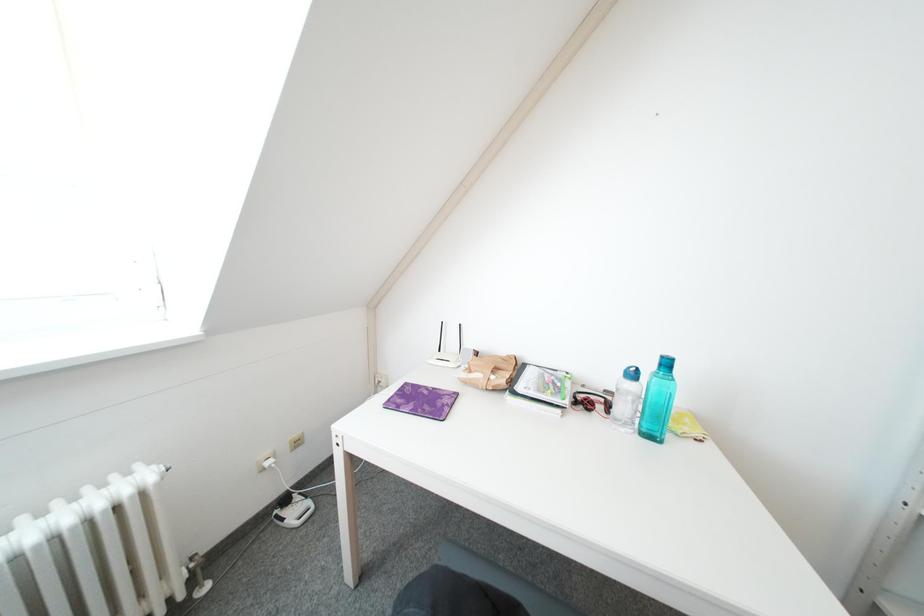
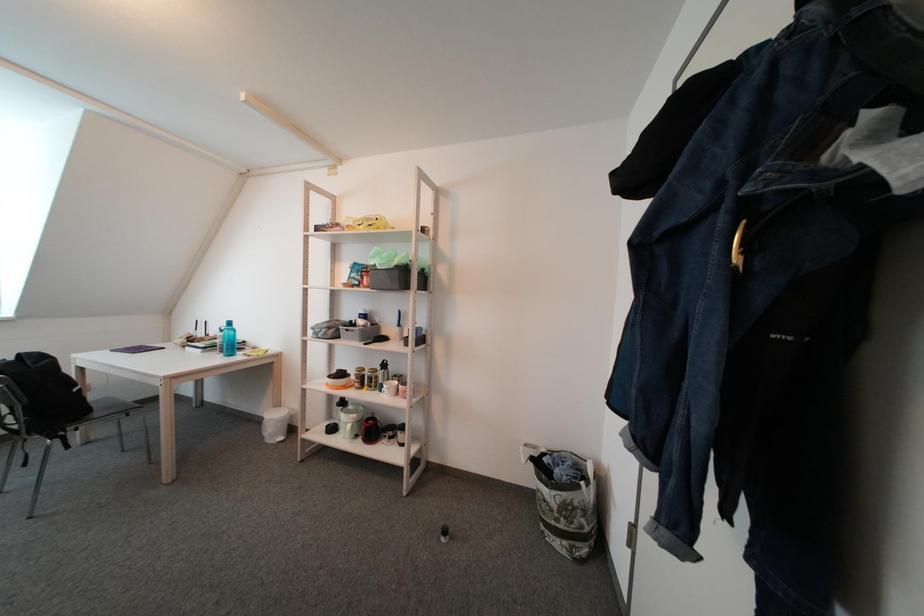
In a continuous first-person perspective shot, in which direction is the camera moving?

The cameraman moved toward right, backward.